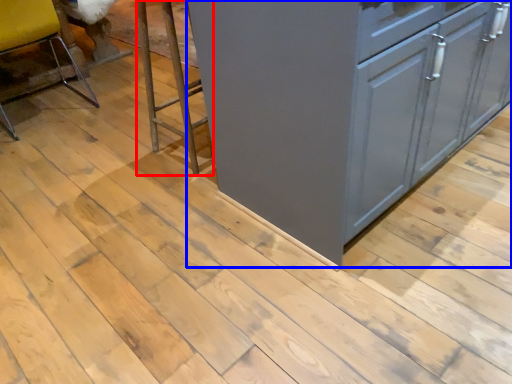
Question: Which point is further to the camera, step stool (highlighted by a red box) or cabinetry (highlighted by a blue box)?

Choices:
 (A) step stool
 (B) cabinetry

Answer: (A)